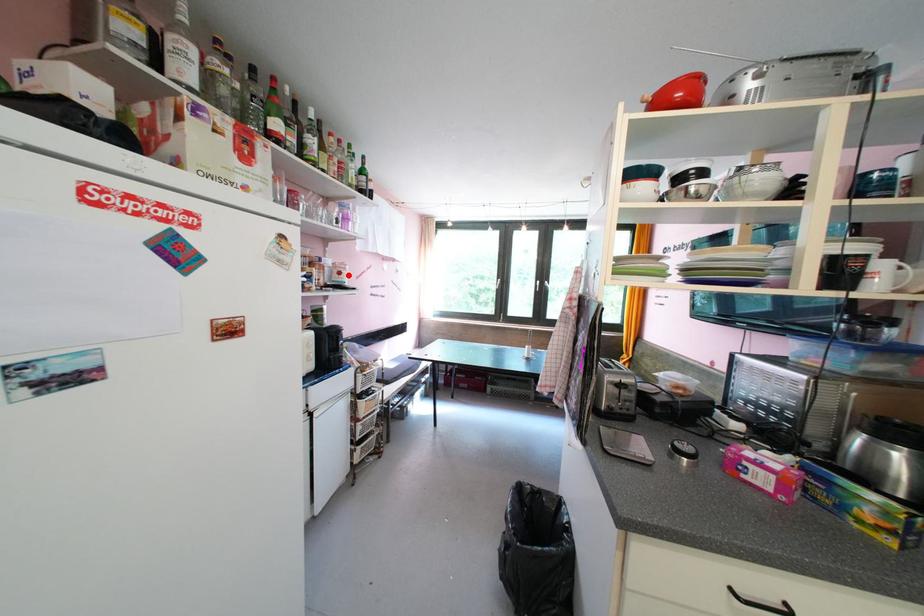
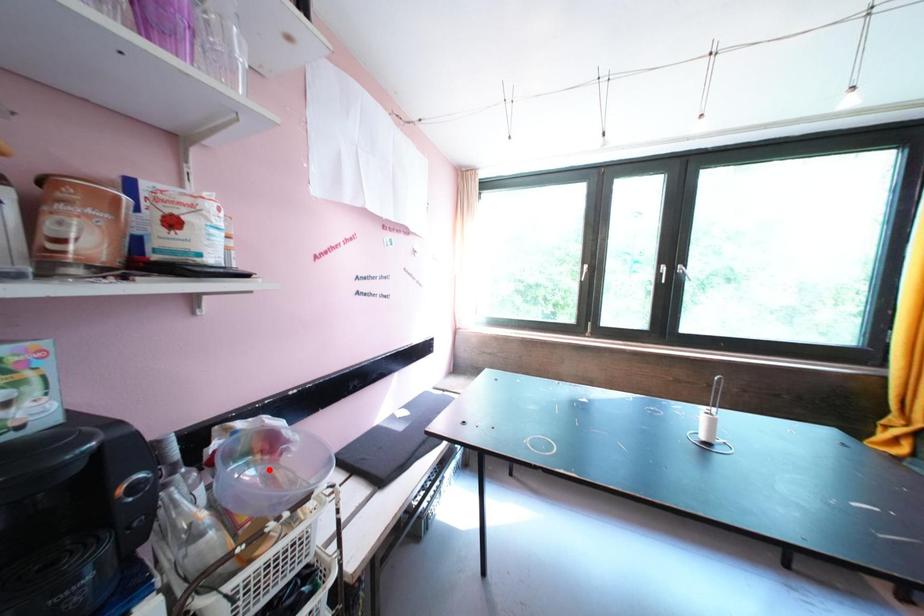
I am providing you with two images of the same scene from different viewpoints. A red point is marked on the first image and another point is marked on the second image. Does the point marked in image1 correspond to the same location as the one in image2?

No